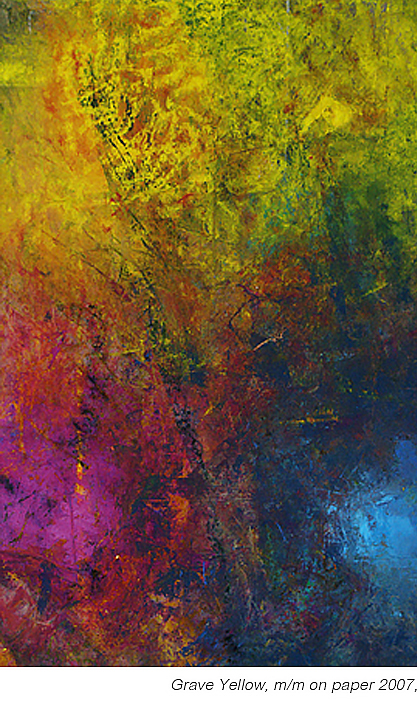
Identify the location of red part of painting. (111, 598), (67, 374), (143, 438).